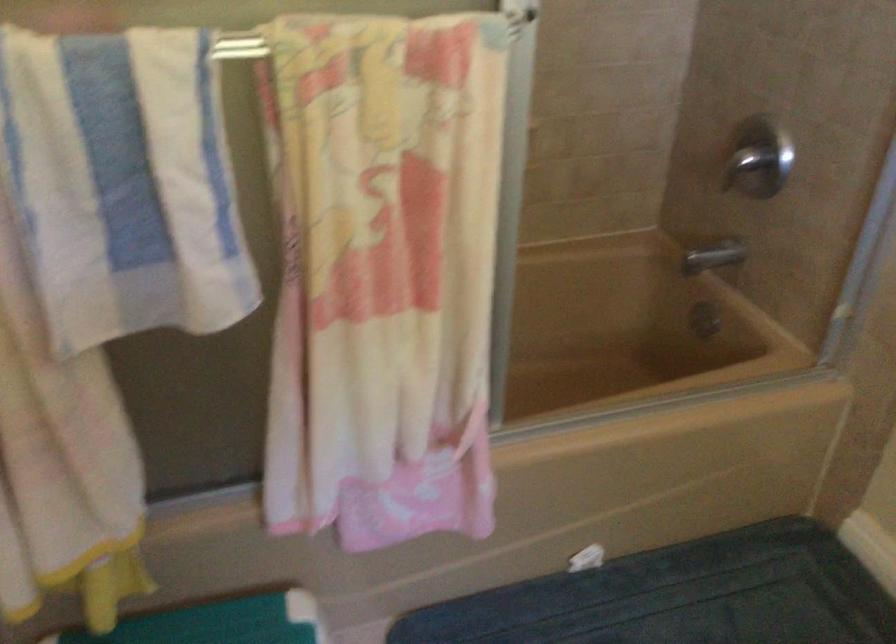
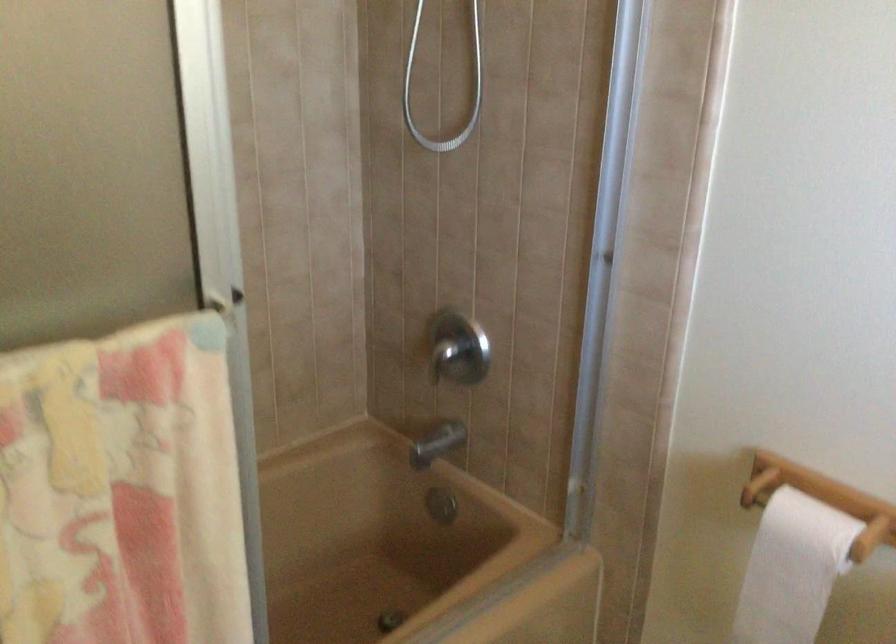
In the second image, find the point that corresponds to pixel 709 252 in the first image.

(436, 444)